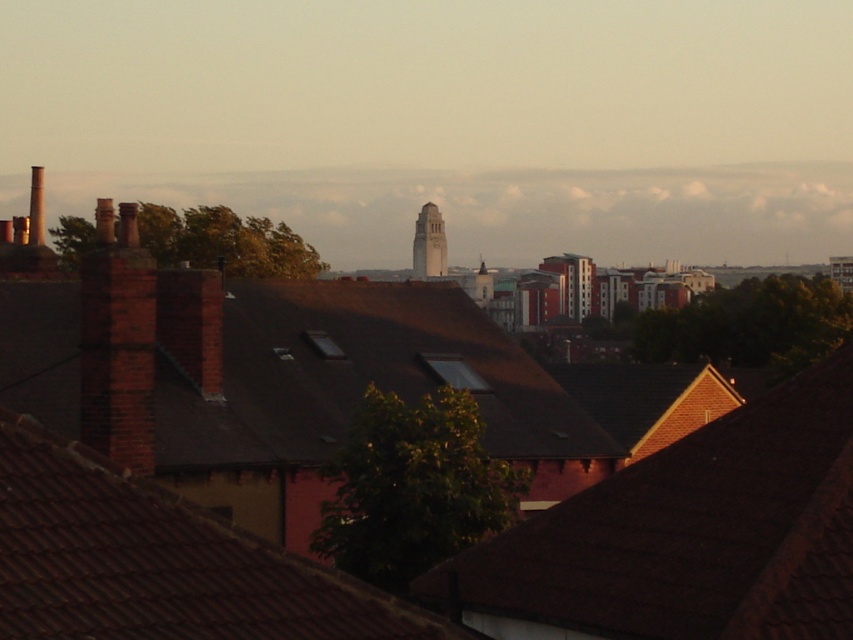
Question: Observing the image, what is the correct spatial positioning of brick chimney at left in reference to smooth concrete clock tower at center?

Choices:
 (A) below
 (B) above

Answer: (A)

Question: Which object is positioned closest to the brown tile roof at center?

Choices:
 (A) brick chimney at left
 (B) brown tile roof at lower right

Answer: (B)

Question: Is the position of brown tile roof at center more distant than that of brick chimney at left?

Choices:
 (A) no
 (B) yes

Answer: (A)

Question: Which point appears closest to the camera in this image?

Choices:
 (A) tap(444, 241)
 (B) tap(834, 552)

Answer: (B)

Question: Does brown tile roof at lower right appear under smooth concrete clock tower at center?

Choices:
 (A) no
 (B) yes

Answer: (B)

Question: Which is farther from the brick chimney at left?

Choices:
 (A) smooth concrete clock tower at center
 (B) brown tile roof at center
 (C) brown tile roof at lower right

Answer: (A)